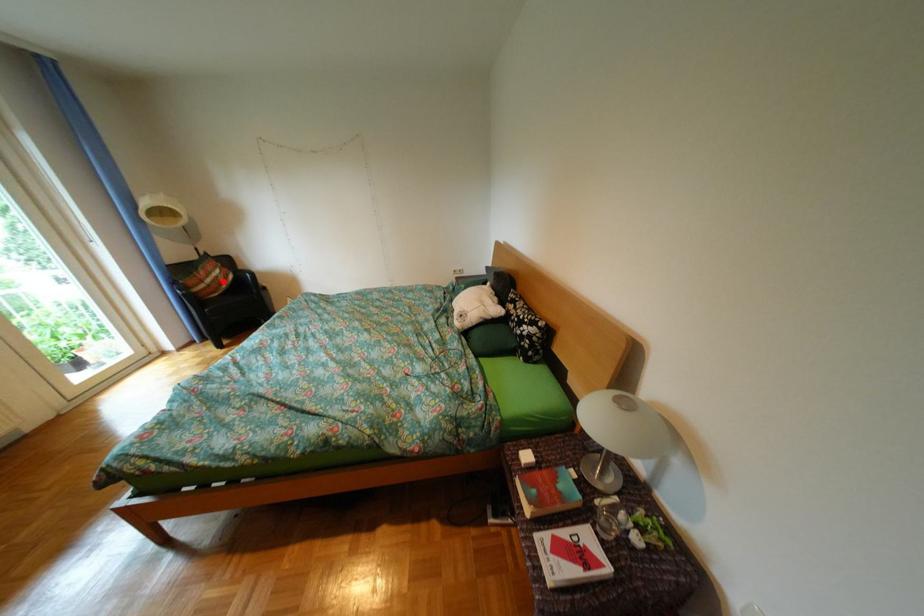
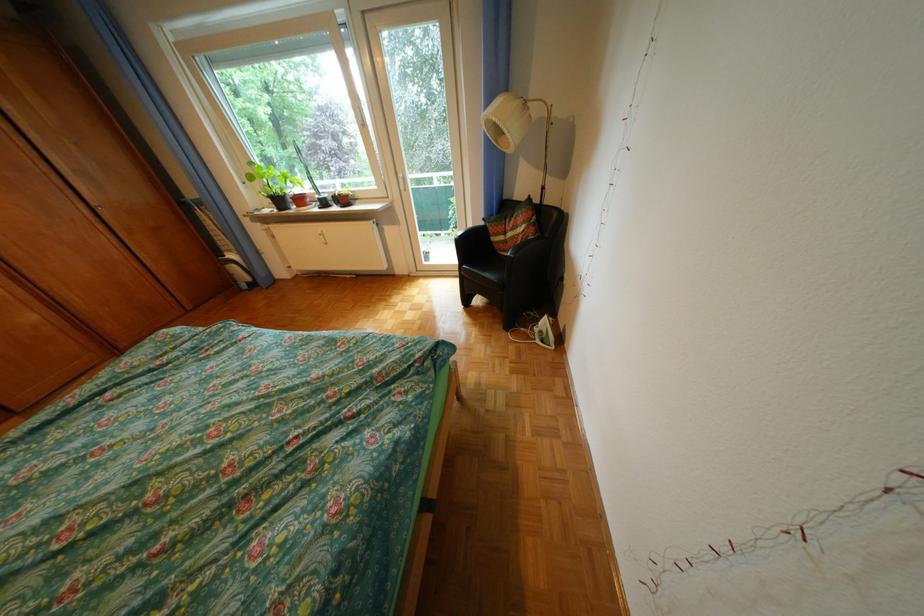
Where in the second image is the point corresponding to the highlighted location from the first image?

(524, 236)